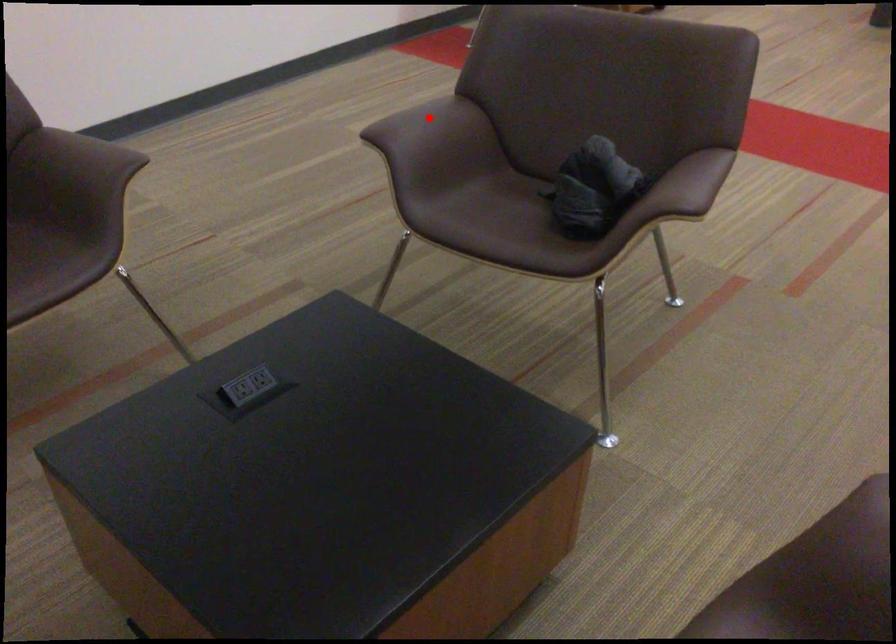
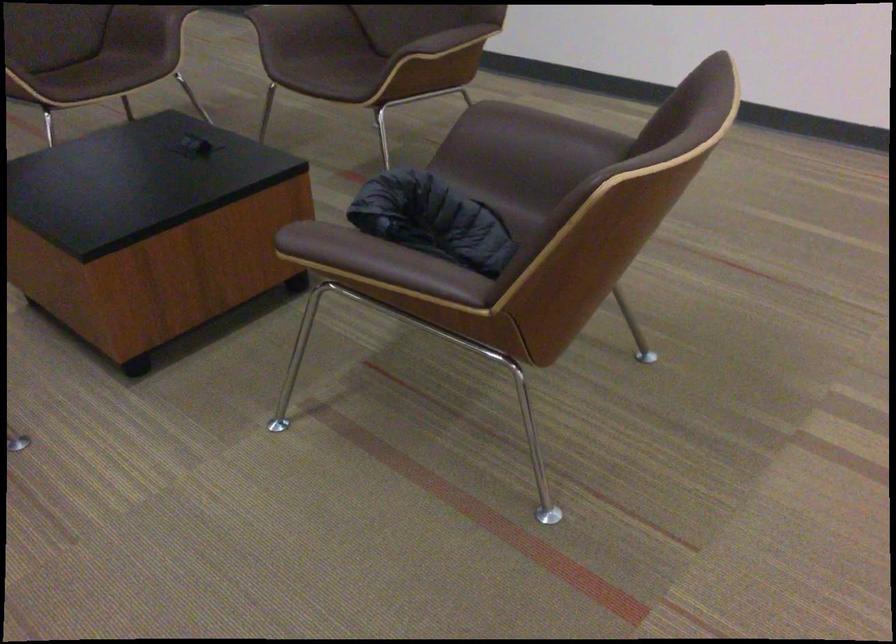
Find the pixel in the second image that matches the highlighted location in the first image.

(545, 128)